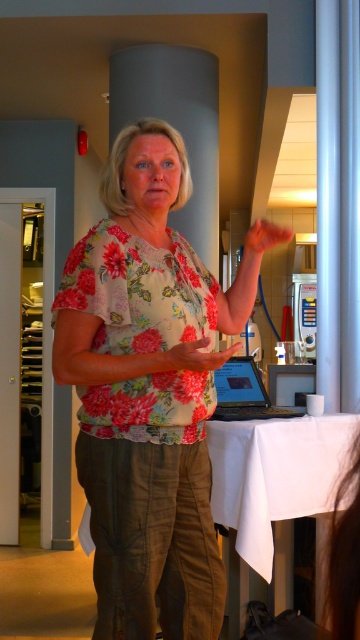
Question: Is white cloth at center further to the viewer compared to black glossy laptop at center?

Choices:
 (A) yes
 (B) no

Answer: (B)

Question: Can you confirm if black glossy laptop at center is smaller than matte floral shirt at center?

Choices:
 (A) yes
 (B) no

Answer: (B)

Question: Which point appears closest to the camera in this image?

Choices:
 (A) (75, 256)
 (B) (293, 486)
 (C) (267, 237)

Answer: (A)

Question: In this image, where is black glossy laptop at center located relative to matte yellow hand at center?

Choices:
 (A) left
 (B) right

Answer: (B)

Question: Among these points, which one is nearest to the camera?

Choices:
 (A) (181, 358)
 (B) (249, 376)
 (C) (249, 246)

Answer: (A)

Question: Estimate the real-world distances between objects in this image. Which object is farther from the matte floral shirt at center?

Choices:
 (A) white cloth at center
 (B) matte yellow hand at center

Answer: (A)